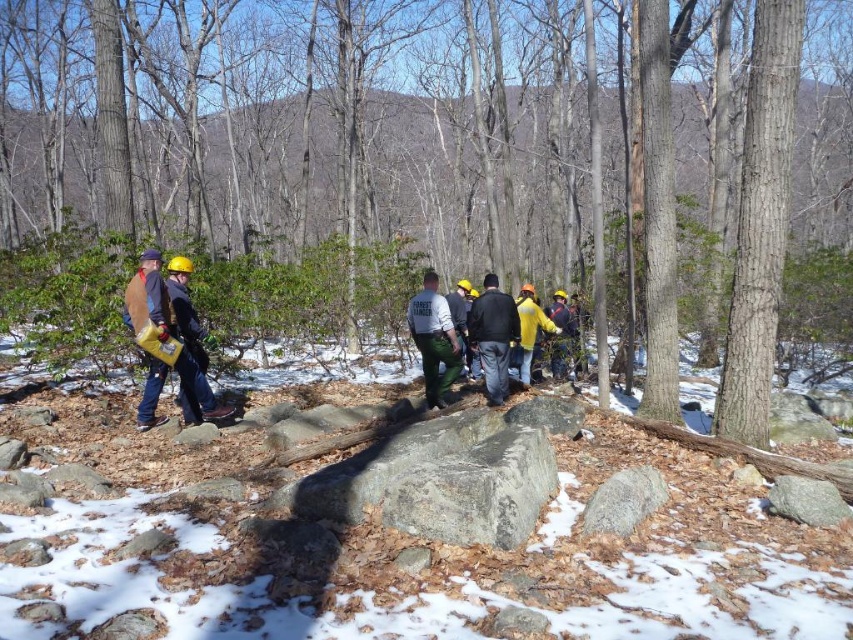
Question: Can you confirm if rough bark tree at center is positioned above hard hat construction worker at left?

Choices:
 (A) no
 (B) yes

Answer: (B)

Question: Among these points, which one is nearest to the camera?

Choices:
 (A) (637, 90)
 (B) (186, 403)
 (C) (508, 388)

Answer: (B)

Question: Observing the image, what is the correct spatial positioning of white powdery snow at center in reference to matte green uniform at center?

Choices:
 (A) left
 (B) right

Answer: (B)

Question: Which object appears farthest from the camera in this image?

Choices:
 (A) rough bark tree at center
 (B) brown bark tree at center
 (C) dark gray jacket at center

Answer: (C)

Question: Which of the following is the closest to the observer?

Choices:
 (A) [445, 316]
 (B) [183, 317]

Answer: (B)

Question: Can you confirm if matte green uniform at center is positioned above hard hat construction worker at left?

Choices:
 (A) no
 (B) yes

Answer: (B)